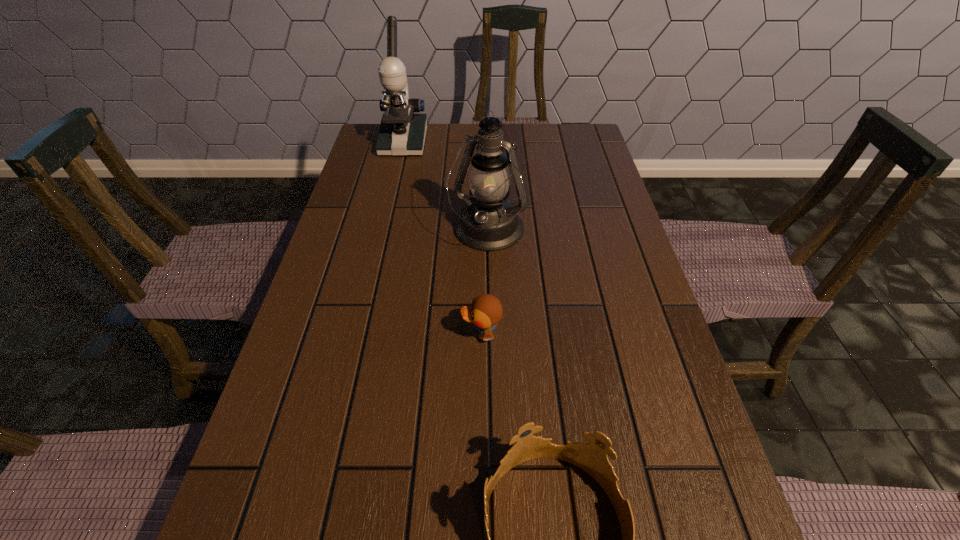
This screenshot has width=960, height=540. In order to click on vacant region between the oil lamp and the farthest object in this screenshot , I will do `click(445, 187)`.

I want to click on object that is the third closest to the duck, so click(401, 133).

Identify which object is the third closest to the tiara. Please provide its 2D coordinates. Your answer should be formatted as a tuple, i.e. [(x, y)], where the tuple contains the x and y coordinates of a point satisfying the conditions above.

[(401, 133)]

Find the location of a particular element. This screenshot has height=540, width=960. vacant area that satisfies the following two spatial constraints: 1. at the eyepiece of the oil lamp; 2. on the right side of the farthest object is located at coordinates [382, 232].